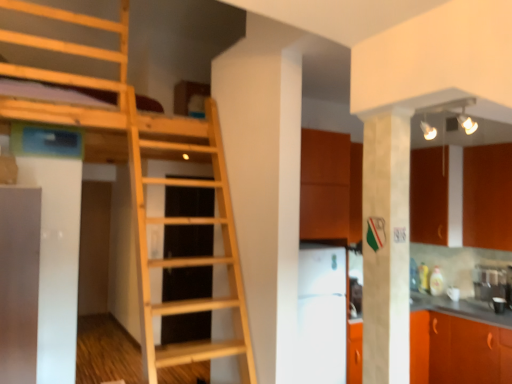
Question: Is light wood ladder at center aimed at orange matte cabinet at lower right, the first cabinetry in the bottom-to-top sequence?

Choices:
 (A) no
 (B) yes

Answer: (A)

Question: Is light wood ladder at center placed right next to orange matte cabinet at lower right, positioned as the 2th cabinetry in top-to-bottom order?

Choices:
 (A) yes
 (B) no

Answer: (B)

Question: Is the position of light wood ladder at center more distant than that of orange matte cabinet at lower right, positioned as the 2th cabinetry in top-to-bottom order?

Choices:
 (A) no
 (B) yes

Answer: (A)

Question: Is light wood ladder at center smaller than orange matte cabinet at lower right, the first cabinetry in the bottom-to-top sequence?

Choices:
 (A) no
 (B) yes

Answer: (A)

Question: Is light wood ladder at center thinner than orange matte cabinet at lower right, positioned as the 2th cabinetry in top-to-bottom order?

Choices:
 (A) yes
 (B) no

Answer: (B)

Question: Considering the positions of light wood ladder at center and white glossy refrigerator at center in the image, is light wood ladder at center taller or shorter than white glossy refrigerator at center?

Choices:
 (A) tall
 (B) short

Answer: (A)

Question: Is light wood ladder at center inside or outside of white glossy refrigerator at center?

Choices:
 (A) outside
 (B) inside

Answer: (A)

Question: Is point (136, 119) closer or farther from the camera than point (330, 372)?

Choices:
 (A) closer
 (B) farther

Answer: (A)

Question: Based on their sizes in the image, would you say light wood ladder at center is bigger or smaller than white glossy refrigerator at center?

Choices:
 (A) big
 (B) small

Answer: (A)

Question: Is orange matte cabinet at lower right, the first cabinetry in the bottom-to-top sequence, inside the boundaries of white marble pillar at center, or outside?

Choices:
 (A) inside
 (B) outside

Answer: (B)

Question: From a real-world perspective, relative to white marble pillar at center, is orange matte cabinet at lower right, positioned as the 2th cabinetry in top-to-bottom order, vertically above or below?

Choices:
 (A) below
 (B) above

Answer: (A)

Question: Based on their sizes in the image, would you say orange matte cabinet at lower right, the first cabinetry in the bottom-to-top sequence, is bigger or smaller than white marble pillar at center?

Choices:
 (A) small
 (B) big

Answer: (B)

Question: Considering the positions of orange matte cabinet at lower right, positioned as the 2th cabinetry in top-to-bottom order, and white marble pillar at center in the image, is orange matte cabinet at lower right, positioned as the 2th cabinetry in top-to-bottom order, wider or thinner than white marble pillar at center?

Choices:
 (A) wide
 (B) thin

Answer: (A)

Question: From a real-world perspective, is white glossy refrigerator at center physically located above or below white marble pillar at center?

Choices:
 (A) above
 (B) below

Answer: (B)

Question: Would you say white glossy refrigerator at center is to the left or to the right of white marble pillar at center in the picture?

Choices:
 (A) left
 (B) right

Answer: (A)